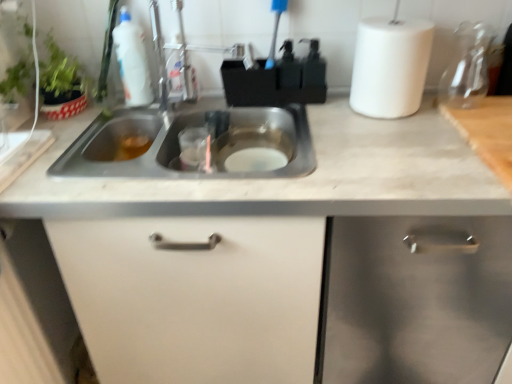
Question: From the image's perspective, is white matte paper towel at upper right positioned above or below white plastic bottle at upper left?

Choices:
 (A) below
 (B) above

Answer: (A)

Question: Is white matte paper towel at upper right to the left or to the right of white plastic bottle at upper left in the image?

Choices:
 (A) right
 (B) left

Answer: (A)

Question: Which object is positioned farthest from the transparent glass carafe at upper right?

Choices:
 (A) stainless steel sink at center
 (B) white plastic bottle at upper left
 (C) green leafy plant at upper left
 (D) white matte paper towel at upper right
 (E) white matte cabinet at right, the 2th cabinetry in the left-to-right sequence

Answer: (C)

Question: Which is farther from the white matte cabinet at right, the 2th cabinetry in the left-to-right sequence?

Choices:
 (A) green leafy plant at upper left
 (B) stainless steel sink at center
 (C) white matte paper towel at upper right
 (D) transparent glass carafe at upper right
 (E) white matte cabinet at center, placed as the 1th cabinetry when sorted from left to right

Answer: (A)